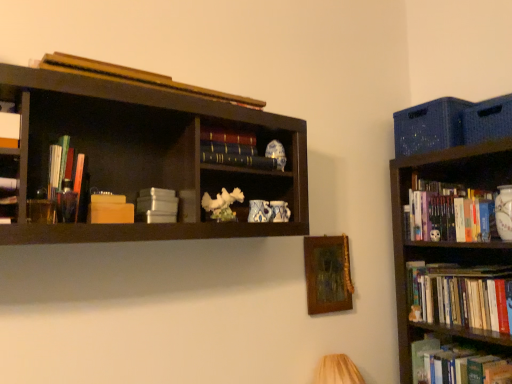
Question: Is hardcover book at lower right, the seventh book in the left-to-right sequence, spatially inside white matte book at upper left, acting as the second book starting from the top, or outside of it?

Choices:
 (A) inside
 (B) outside

Answer: (B)

Question: From the image's perspective, is hardcover book at lower right, which is the eighth book from top to bottom, above or below white matte book at upper left, which is the eighth book from right to left?

Choices:
 (A) below
 (B) above

Answer: (A)

Question: Which of these objects is positioned farthest from the white matte stack of boxes at center-left, which appears as the sixth book when viewed from the right?

Choices:
 (A) wooden picture frame at center
 (B) hardcover books at right, which appears as the eighth book when viewed from the left
 (C) hardcover book at center, which is the 5th book in left-to-right order
 (D) hardcover books at right, arranged as the third book when viewed from the right
 (E) hardcover book at lower right, the seventh book in the left-to-right sequence

Answer: (E)

Question: Estimate the real-world distances between objects in this image. Which object is closer to the matte orange paperback book at left?

Choices:
 (A) white matte book at upper left, marked as the seventh book in a bottom-to-top arrangement
 (B) wooden book at upper center, the 8th book in the bottom-to-top sequence
 (C) wooden picture frame at center
 (D) white matte stack of boxes at center-left, which ranks as the 3th book in left-to-right order
 (E) hardcover book at lower right, which is the eighth book from top to bottom

Answer: (D)